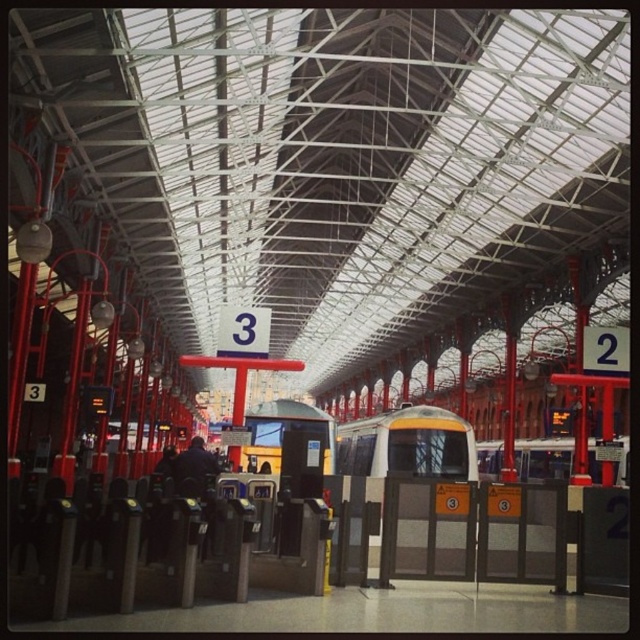
Who is more forward, [336,456] or [595,440]?

Point [336,456] is more forward.

Can you confirm if yellow and white train at center is taller than yellow metallic train at center?

No, yellow and white train at center is not taller than yellow metallic train at center.

Measure the distance between yellow and white train at center and camera.

The distance of yellow and white train at center from camera is 102.00 feet.

At what (x,y) coordinates should I click in order to perform the action: click on yellow and white train at center. Please return your answer as a coordinate pair (x, y). Looking at the image, I should click on (406, 444).